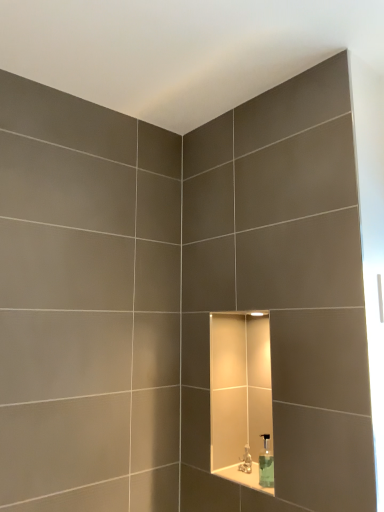
Identify the location of vacant area on top of white glossy ledge at center (from a real-world perspective). The image size is (384, 512). (251, 477).